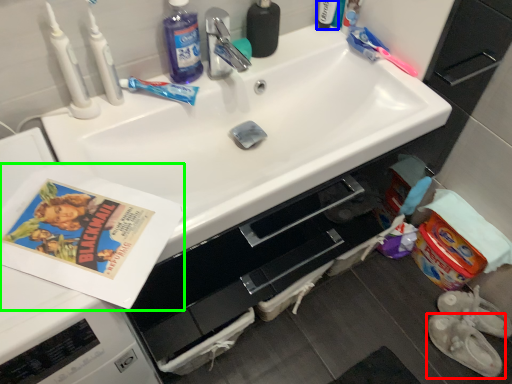
Question: Estimate the real-world distances between objects in this image. Which object is closer to footwear (highlighted by a red box), toiletry (highlighted by a blue box) or paperback book (highlighted by a green box)?

Choices:
 (A) toiletry
 (B) paperback book

Answer: (A)